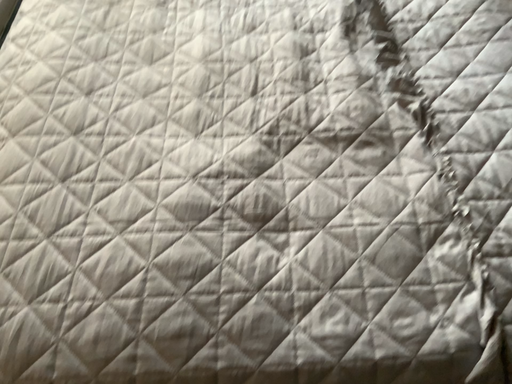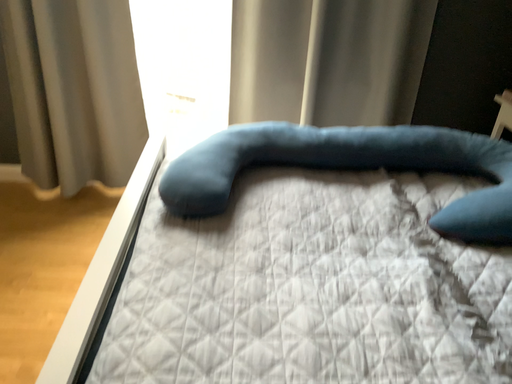
Question: Which way did the camera rotate in the video?

Choices:
 (A) rotated upward
 (B) rotated downward

Answer: (A)